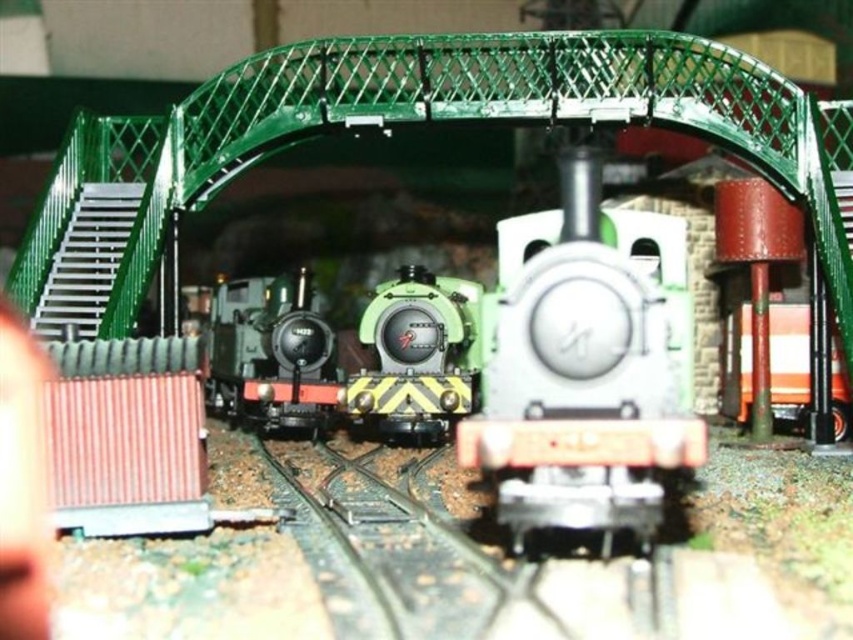
Question: Can you confirm if metallic green train at center is smaller than green matte train at center?

Choices:
 (A) yes
 (B) no

Answer: (A)

Question: Is metallic green train at center further to the viewer compared to green matte train at center?

Choices:
 (A) yes
 (B) no

Answer: (B)

Question: Among these objects, which one is nearest to the camera?

Choices:
 (A) green matte train at center
 (B) metallic green train at center

Answer: (B)

Question: Which point is farther from the camera taking this photo?

Choices:
 (A) 637,529
 (B) 383,353

Answer: (B)

Question: Is metallic green train at center smaller than green matte train at center?

Choices:
 (A) yes
 (B) no

Answer: (A)